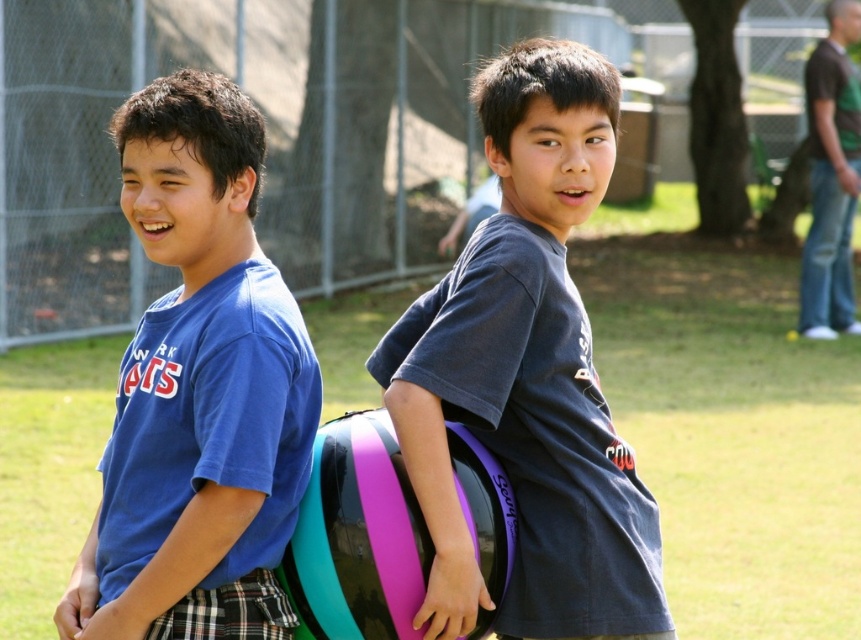
How far apart are purple glossy frisbee at center and blue matte shirt at left?

purple glossy frisbee at center and blue matte shirt at left are 57.37 centimeters apart.

Does purple glossy frisbee at center have a greater width compared to blue matte shirt at left?

Indeed, purple glossy frisbee at center has a greater width compared to blue matte shirt at left.

Which is in front, point (637, 586) or point (246, 460)?

Point (246, 460) is more forward.

I want to click on purple glossy frisbee at center, so click(x=528, y=376).